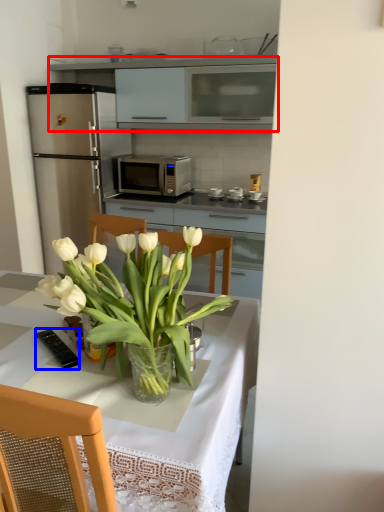
Question: Which point is further to the camera, cabinetry (highlighted by a red box) or appliance (highlighted by a blue box)?

Choices:
 (A) cabinetry
 (B) appliance

Answer: (A)